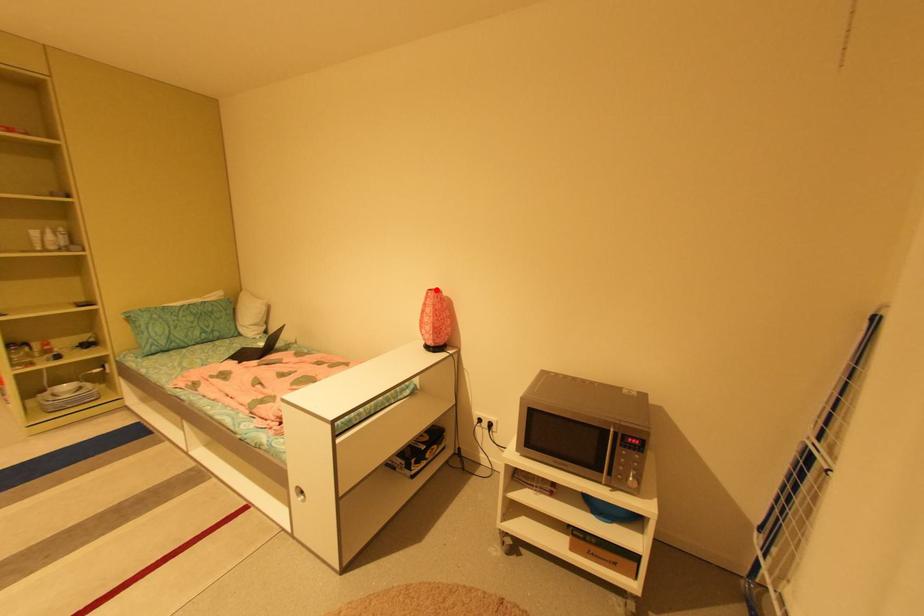
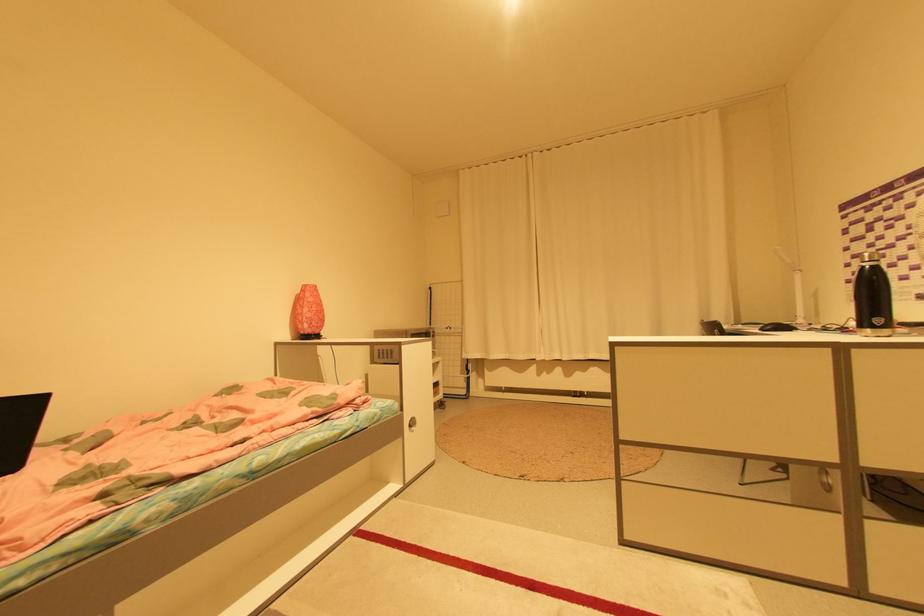
In the second image, find the point that corresponds to the highlighted location in the first image.

(311, 285)